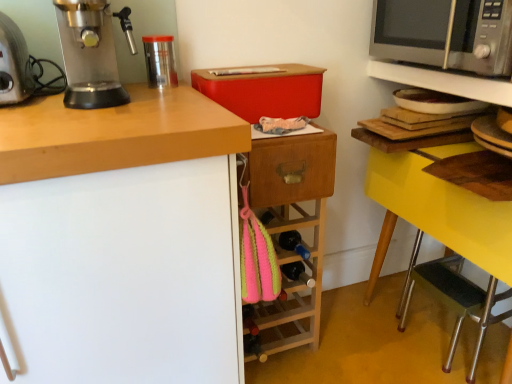
Find the location of a particular element. This screenshot has height=384, width=512. vacant area on top of wooden drawer at center (from a real-world perspective) is located at coordinates (285, 123).